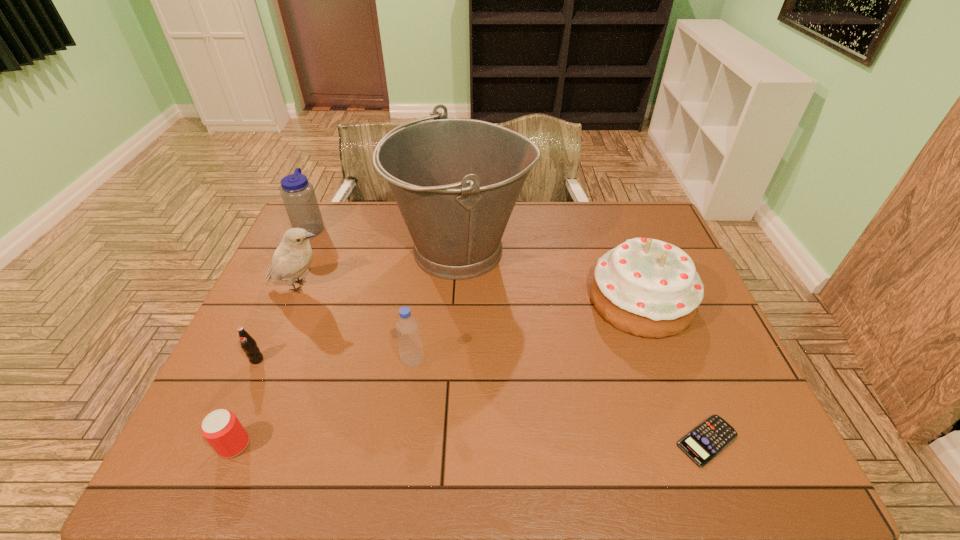
This screenshot has height=540, width=960. In order to click on unoccupied position between the shortest object and the water bottle in this screenshot , I will do `click(509, 334)`.

The width and height of the screenshot is (960, 540). In order to click on free space between the second shortest object and the bird in this screenshot , I will do `click(267, 366)`.

You are a GUI agent. You are given a task and a screenshot of the screen. Output one action in this format:
    pyautogui.click(x=<x>, y=<y>)
    Task: Click on the vacant space that is in between the pop and the cake
    The height and width of the screenshot is (540, 960).
    Given the screenshot: What is the action you would take?
    pyautogui.click(x=449, y=330)

This screenshot has height=540, width=960. Find the location of `empty location between the beer can and the bucket`. empty location between the beer can and the bucket is located at coordinates (348, 348).

Identify the location of object that is the third closest one to the shortest object. The width and height of the screenshot is (960, 540). (410, 347).

Image resolution: width=960 pixels, height=540 pixels. I want to click on the sixth closest object relative to the beer can, so click(x=645, y=287).

You are a GUI agent. You are given a task and a screenshot of the screen. Output one action in this format:
    pyautogui.click(x=<x>, y=<y>)
    Task: Click on the free spot that satisfies the following two spatial constraints: 1. with a carrying loop on the side of the water bottle; 2. on the left side of the calculator
    Image resolution: width=960 pixels, height=540 pixels.
    Given the screenshot: What is the action you would take?
    pyautogui.click(x=210, y=441)

The width and height of the screenshot is (960, 540). Identify the location of free point that satisfies the following two spatial constraints: 1. with a carrying loop on the side of the bottle; 2. on the left side of the water bottle. (248, 361).

Find the location of a particular element. The height and width of the screenshot is (540, 960). blank space that satisfies the following two spatial constraints: 1. with a carrying loop on the side of the water bottle; 2. on the left side of the cake is located at coordinates (276, 300).

Identify the location of free space that satisfies the following two spatial constraints: 1. with a carrying loop on the side of the water bottle; 2. on the left side of the calculator. The image size is (960, 540). (210, 441).